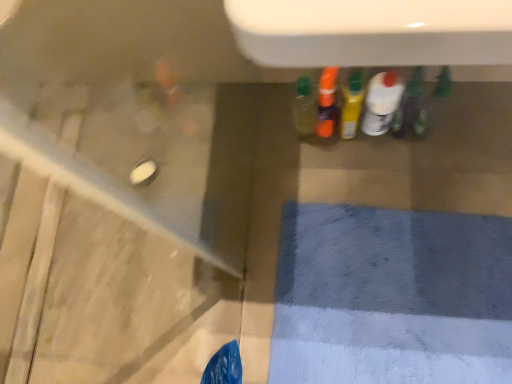
The image size is (512, 384). What are the coordinates of `vacant area to the right of white glossy bottle at center, the second bottle positioned from the right` in the screenshot? It's located at (451, 115).